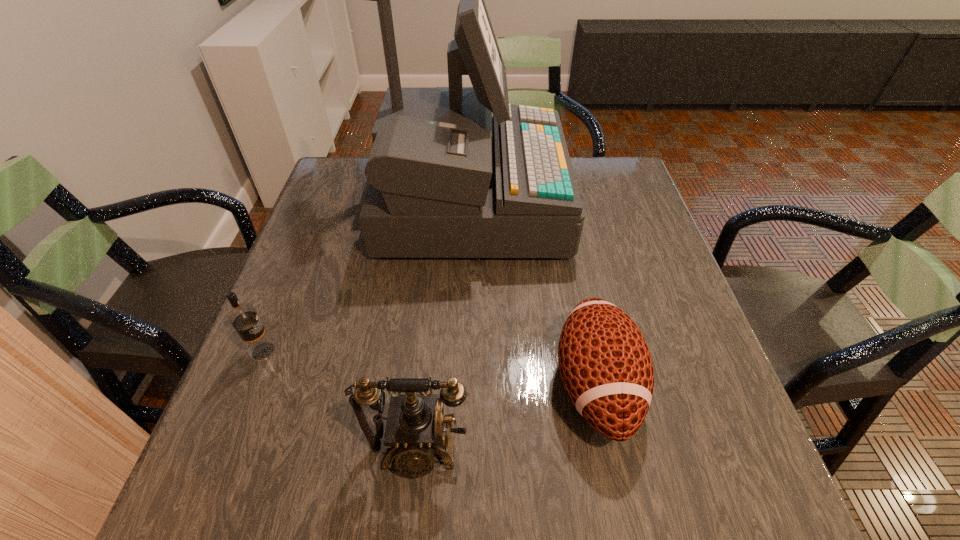
What are the coordinates of `football at the near edge` in the screenshot? It's located at (605, 364).

In order to click on cash register situated at the left edge in this screenshot , I will do `click(447, 179)`.

At what (x,y) coordinates should I click in order to perform the action: click on vodka that is positioned at the left edge. Please return your answer as a coordinate pair (x, y). Looking at the image, I should click on coord(243,317).

Locate an element on the screen. This screenshot has height=540, width=960. object present at the right edge is located at coordinates (605, 364).

At what (x,y) coordinates should I click in order to perform the action: click on object positioned at the far left corner. Please return your answer as a coordinate pair (x, y). This screenshot has height=540, width=960. Looking at the image, I should click on (447, 179).

I want to click on object located in the near right corner section of the desktop, so click(x=605, y=364).

Where is `vacant space at the near edge of the desktop`? The width and height of the screenshot is (960, 540). vacant space at the near edge of the desktop is located at coordinates (331, 497).

Find the location of a particular element. Image resolution: width=960 pixels, height=540 pixels. free space at the left edge of the desktop is located at coordinates (283, 316).

You are a GUI agent. You are given a task and a screenshot of the screen. Output one action in this format:
    pyautogui.click(x=<x>, y=<y>)
    Task: Click on the vacant space at the right edge of the desktop
    The image size is (960, 540).
    Given the screenshot: What is the action you would take?
    pyautogui.click(x=623, y=260)

The height and width of the screenshot is (540, 960). I want to click on vacant space at the far left corner of the desktop, so click(x=340, y=191).